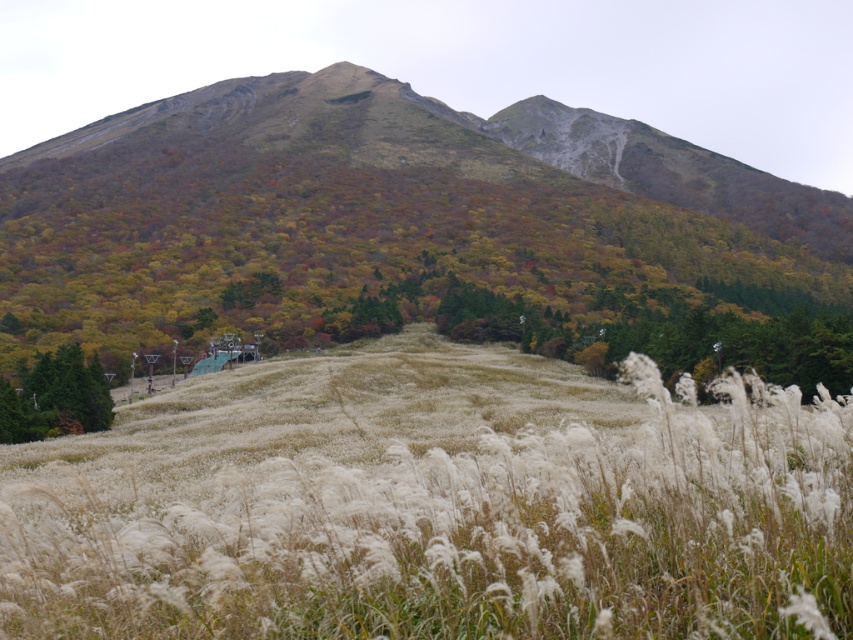
Is point (741, 186) positioned after point (57, 408)?

Yes, it is behind point (57, 408).

Identify the location of multicolored foliage at upper center. The width and height of the screenshot is (853, 640). (440, 147).

Does white fluffy grass at center lie behind multicolored foliage at upper center?

No, it is not.

Between point (318, 582) and point (12, 208), which one is positioned behind?

The point (12, 208) is behind.

Image resolution: width=853 pixels, height=640 pixels. I want to click on white fluffy grass at center, so click(434, 506).

Does white fluffy grass at center have a greater height compared to green matte tree at lower left?

Indeed, white fluffy grass at center has a greater height compared to green matte tree at lower left.

Can you confirm if white fluffy grass at center is positioned below green matte tree at lower left?

Actually, white fluffy grass at center is above green matte tree at lower left.

This screenshot has height=640, width=853. Describe the element at coordinates (434, 506) in the screenshot. I see `white fluffy grass at center` at that location.

The width and height of the screenshot is (853, 640). I want to click on white fluffy grass at center, so click(434, 506).